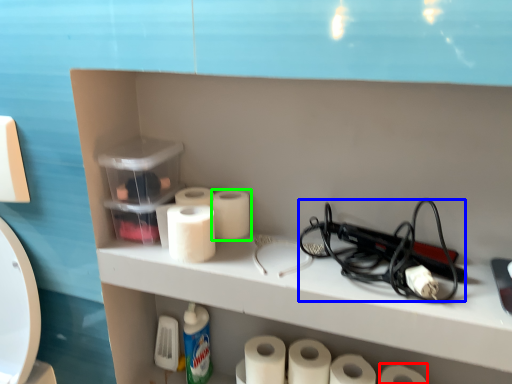
Question: Which object is the closest to the toilet paper (highlighted by a red box)? Choose among these: equipment (highlighted by a blue box) or toilet paper (highlighted by a green box).

Choices:
 (A) equipment
 (B) toilet paper

Answer: (A)